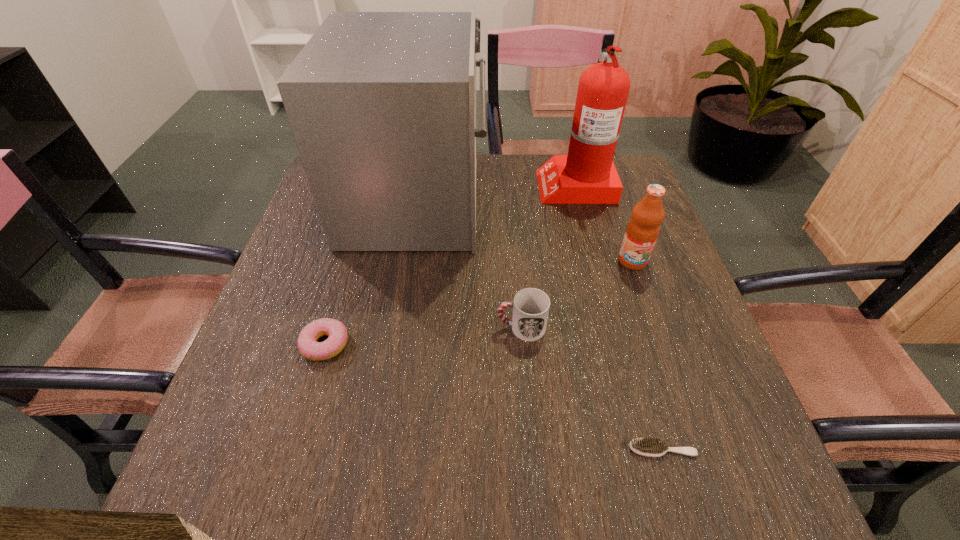
This screenshot has width=960, height=540. In order to click on toaster oven in this screenshot , I will do `click(382, 105)`.

The width and height of the screenshot is (960, 540). In order to click on fire extinguisher in this screenshot , I will do `click(587, 175)`.

Locate an element on the screen. The height and width of the screenshot is (540, 960). the fourth shortest object is located at coordinates (642, 230).

I want to click on cup, so click(531, 306).

I want to click on the third object from left to right, so click(x=531, y=306).

Identify the location of doughnut. (308, 346).

The image size is (960, 540). Find the location of `the shortest object`. the shortest object is located at coordinates (647, 446).

Image resolution: width=960 pixels, height=540 pixels. I want to click on the nearest object, so pos(647,446).

What are the coordinates of `vacant space situated 0.120m on the front panel of the toaster oven` in the screenshot? It's located at (529, 201).

Locate an element on the screen. free region located 0.050m on the front-facing side of the fire extinguisher is located at coordinates (521, 184).